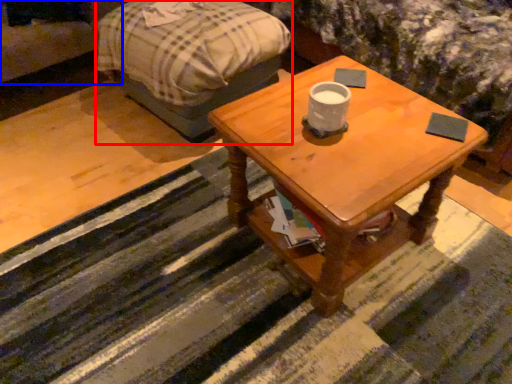
Question: Among these objects, which one is farthest to the camera, bed frame (highlighted by a red box) or couch (highlighted by a blue box)?

Choices:
 (A) bed frame
 (B) couch

Answer: (B)